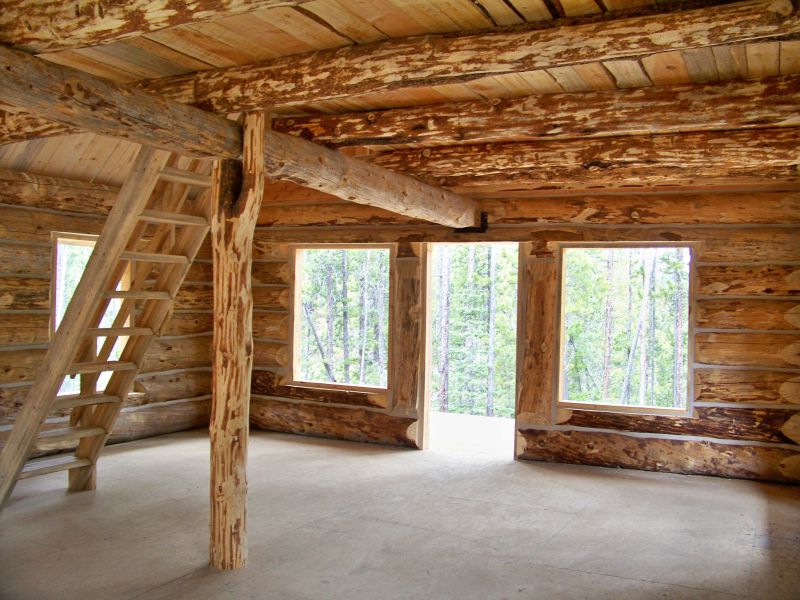
The height and width of the screenshot is (600, 800). Find the location of `ceiling board`. ceiling board is located at coordinates [x=68, y=149].